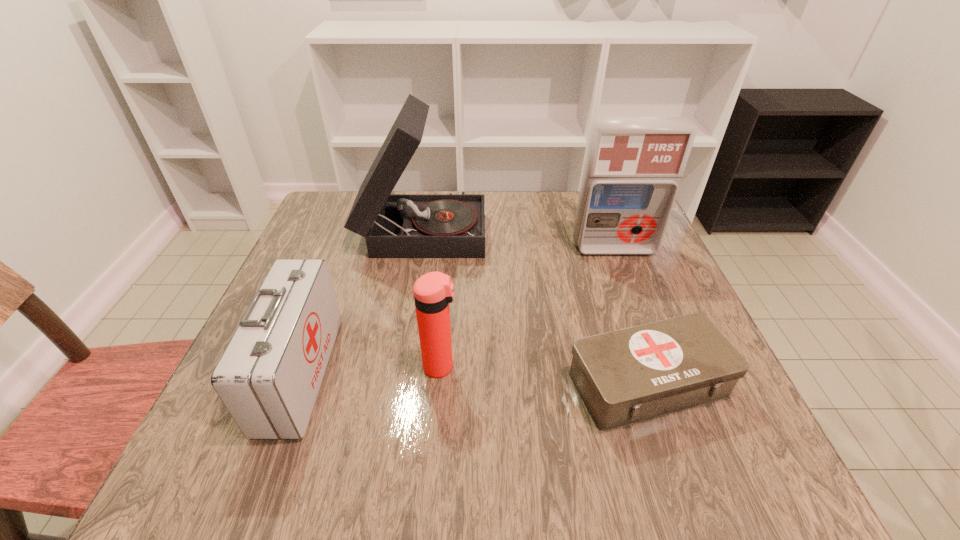
At what (x,y) coordinates should I click in order to perform the action: click on vacant region located on the back of the shortest first-aid kit. Please return your answer as a coordinate pair (x, y). Looking at the image, I should click on (606, 261).

Where is `object that is at the far edge`? object that is at the far edge is located at coordinates (450, 225).

Where is `object that is at the near edge`? The height and width of the screenshot is (540, 960). object that is at the near edge is located at coordinates (268, 378).

Where is `phonograph_record present at the left edge`? This screenshot has width=960, height=540. phonograph_record present at the left edge is located at coordinates (450, 225).

Identify the location of the first-aid kit at the left edge. click(268, 378).

The image size is (960, 540). I want to click on object that is at the far left corner, so click(x=450, y=225).

This screenshot has height=540, width=960. Find the location of `object located at the near left corner`. object located at the near left corner is located at coordinates (268, 378).

Image resolution: width=960 pixels, height=540 pixels. What are the coordinates of `free space at the far edge of the desktop` in the screenshot? It's located at (524, 208).

The image size is (960, 540). In the image, there is a desktop. Identify the location of free space at the near edge. (459, 488).

Where is `vacant region at the left edge of the desktop`? vacant region at the left edge of the desktop is located at coordinates (324, 256).